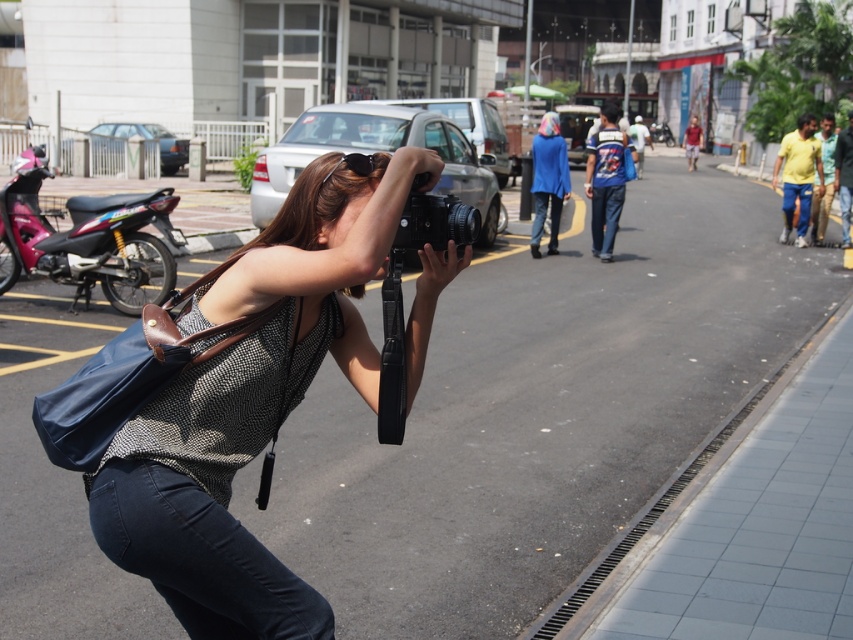
Question: Which point appears farthest from the camera in this image?

Choices:
 (A) (x=45, y=177)
 (B) (x=251, y=436)
 (C) (x=444, y=244)

Answer: (A)

Question: Which object is the farthest from the metallic pink motorcycle at left?

Choices:
 (A) black matte camera at center
 (B) matte black camera at center

Answer: (A)

Question: Among these points, which one is nearest to the camera?

Choices:
 (A) (474, 211)
 (B) (84, 236)
 (C) (221, 404)

Answer: (C)

Question: Is matte black camera at center positioned behind black matte camera at center?

Choices:
 (A) yes
 (B) no

Answer: (B)

Question: Can you confirm if matte black camera at center is positioned to the left of metallic pink motorcycle at left?

Choices:
 (A) no
 (B) yes

Answer: (A)

Question: Does metallic pink motorcycle at left appear on the right side of black matte camera at center?

Choices:
 (A) yes
 (B) no

Answer: (B)